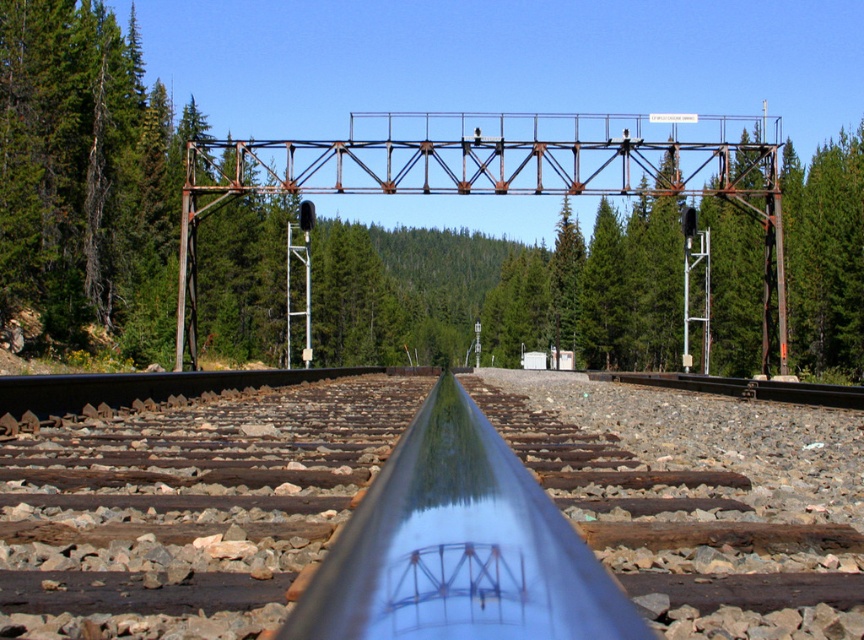
Does green leafy forest at upper center appear on the left side of metal at center?

In fact, green leafy forest at upper center is to the right of metal at center.

Is point (384, 340) less distant than point (861, 580)?

No, (384, 340) is behind (861, 580).

Does point (87, 83) come farther from viewer compared to point (191, 540)?

That is True.

Where is `green leafy forest at upper center`? green leafy forest at upper center is located at coordinates (87, 179).